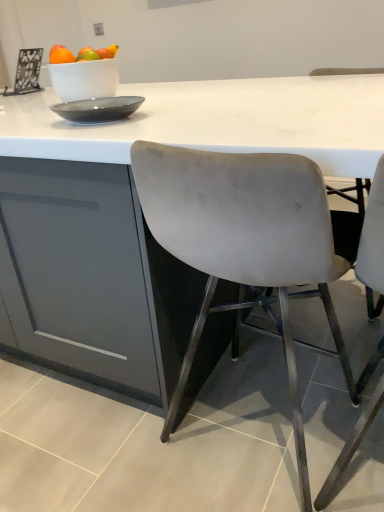
Find the location of a particular element. matte gray chair at right, which appears as the first chair when viewed from the right is located at coordinates pos(373,236).

This screenshot has height=512, width=384. I want to click on white marble table at center, so click(218, 121).

Is matte gray chair at right, positioned as the second chair in left-to-right order, behind satin grey chair at center, which is the 1th chair in left-to-right order?

No, it is in front of satin grey chair at center, which is the 1th chair in left-to-right order.

Is matte gray chair at right, positioned as the second chair in left-to-right order, positioned far away from satin grey chair at center, which is the 1th chair in left-to-right order?

They are positioned close to each other.

From a real-world perspective, which is physically above, matte gray chair at right, which appears as the first chair when viewed from the right, or satin grey chair at center, which is the 1th chair in left-to-right order?

In real-world perspective, satin grey chair at center, which is the 1th chair in left-to-right order, is above.

From their relative heights in the image, would you say matte gray chair at right, which appears as the first chair when viewed from the right, is taller or shorter than satin grey chair at center, which is the 1th chair in left-to-right order?

In the image, matte gray chair at right, which appears as the first chair when viewed from the right, appears to be taller than satin grey chair at center, which is the 1th chair in left-to-right order.

Between white marble table at center and matte gray chair at right, positioned as the second chair in left-to-right order, which one has larger size?

With larger size is white marble table at center.

Is white marble table at center directly adjacent to matte gray chair at right, positioned as the second chair in left-to-right order?

white marble table at center and matte gray chair at right, positioned as the second chair in left-to-right order, are not in contact.

Is white marble table at center taller than matte gray chair at right, positioned as the second chair in left-to-right order?

Yes, white marble table at center is taller than matte gray chair at right, positioned as the second chair in left-to-right order.

From a real-world perspective, which object stands above the other?

matte gray chair at right, which appears as the first chair when viewed from the right.

Is satin grey chair at center, which is the 1th chair in left-to-right order, situated inside matte gray chair at right, positioned as the second chair in left-to-right order, or outside?

satin grey chair at center, which is the 1th chair in left-to-right order, is located beyond the bounds of matte gray chair at right, positioned as the second chair in left-to-right order.

Can you confirm if satin grey chair at center, placed as the second chair when sorted from right to left, is taller than matte gray chair at right, positioned as the second chair in left-to-right order?

In fact, satin grey chair at center, placed as the second chair when sorted from right to left, may be shorter than matte gray chair at right, positioned as the second chair in left-to-right order.

Can you confirm if satin grey chair at center, which is the 1th chair in left-to-right order, is smaller than matte gray chair at right, which appears as the first chair when viewed from the right?

No.

Could you tell me if satin grey chair at center, placed as the second chair when sorted from right to left, is turned towards matte gray chair at right, which appears as the first chair when viewed from the right?

No, satin grey chair at center, placed as the second chair when sorted from right to left, does not turn towards matte gray chair at right, which appears as the first chair when viewed from the right.

Where is `the 1st chair counting from the right side of the white marble table at center`? The width and height of the screenshot is (384, 512). the 1st chair counting from the right side of the white marble table at center is located at coordinates (245, 242).

In terms of height, does satin grey chair at center, placed as the second chair when sorted from right to left, look taller or shorter compared to white marble table at center?

Clearly, satin grey chair at center, placed as the second chair when sorted from right to left, is shorter compared to white marble table at center.

How different are the orientations of satin grey chair at center, which is the 1th chair in left-to-right order, and white marble table at center in degrees?

92.1 degrees separate the facing orientations of satin grey chair at center, which is the 1th chair in left-to-right order, and white marble table at center.

Which is behind, point (136, 152) or point (246, 106)?

Positioned behind is point (246, 106).

From the image's perspective, which is above, white marble table at center or satin grey chair at center, placed as the second chair when sorted from right to left?

From the image's view, white marble table at center is above.

Could you tell me if white marble table at center is turned towards satin grey chair at center, which is the 1th chair in left-to-right order?

No, white marble table at center does not turn towards satin grey chair at center, which is the 1th chair in left-to-right order.

Is white marble table at center to the left of satin grey chair at center, placed as the second chair when sorted from right to left, from the viewer's perspective?

Correct, you'll find white marble table at center to the left of satin grey chair at center, placed as the second chair when sorted from right to left.

Do you think white marble table at center is within satin grey chair at center, placed as the second chair when sorted from right to left, or outside of it?

white marble table at center is spatially situated outside satin grey chair at center, placed as the second chair when sorted from right to left.

Considering the positions of objects matte gray chair at right, positioned as the second chair in left-to-right order, and white marble table at center in the image provided, who is more to the right, matte gray chair at right, positioned as the second chair in left-to-right order, or white marble table at center?

Positioned to the right is matte gray chair at right, positioned as the second chair in left-to-right order.

Is matte gray chair at right, positioned as the second chair in left-to-right order, looking in the opposite direction of white marble table at center?

Correct, matte gray chair at right, positioned as the second chair in left-to-right order, is looking away from white marble table at center.

Is matte gray chair at right, which appears as the first chair when viewed from the right, behind white marble table at center?

No, it is not.

Considering the sizes of objects matte gray chair at right, which appears as the first chair when viewed from the right, and white marble table at center in the image provided, who is thinner, matte gray chair at right, which appears as the first chair when viewed from the right, or white marble table at center?

With smaller width is matte gray chair at right, which appears as the first chair when viewed from the right.

Where is `chair on the right of the satin grey chair at center, placed as the second chair when sorted from right to left`? The height and width of the screenshot is (512, 384). chair on the right of the satin grey chair at center, placed as the second chair when sorted from right to left is located at coordinates (373, 236).

From a real-world perspective, which chair is the 1st one above the white marble table at center? Please provide its 2D coordinates.

[(373, 236)]

Considering their positions, is matte gray chair at right, which appears as the first chair when viewed from the right, positioned closer to white marble table at center than satin grey chair at center, which is the 1th chair in left-to-right order?

satin grey chair at center, which is the 1th chair in left-to-right order, lies closer to white marble table at center than the other object.

Based on the photo, based on their spatial positions, is satin grey chair at center, placed as the second chair when sorted from right to left, or matte gray chair at right, positioned as the second chair in left-to-right order, further from white marble table at center?

Based on the image, matte gray chair at right, positioned as the second chair in left-to-right order, appears to be further to white marble table at center.

Which object lies nearer to the anchor point satin grey chair at center, which is the 1th chair in left-to-right order, white marble table at center or matte gray chair at right, positioned as the second chair in left-to-right order?

white marble table at center.

Considering their positions, is satin grey chair at center, placed as the second chair when sorted from right to left, positioned further to matte gray chair at right, which appears as the first chair when viewed from the right, than white marble table at center?

white marble table at center.

Estimate the real-world distances between objects in this image. Which object is further from matte gray chair at right, which appears as the first chair when viewed from the right, white marble table at center or satin grey chair at center, placed as the second chair when sorted from right to left?

white marble table at center is positioned further to the anchor matte gray chair at right, which appears as the first chair when viewed from the right.

When comparing their distances from satin grey chair at center, which is the 1th chair in left-to-right order, does matte gray chair at right, positioned as the second chair in left-to-right order, or white marble table at center seem further?

Based on the image, matte gray chair at right, positioned as the second chair in left-to-right order, appears to be further to satin grey chair at center, which is the 1th chair in left-to-right order.

I want to click on chair between white marble table at center and matte gray chair at right, positioned as the second chair in left-to-right order, so click(245, 242).